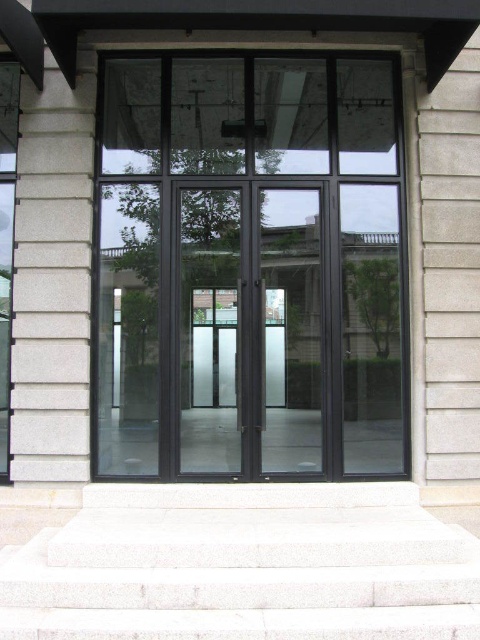
Is black glass window at center above white stone stairs at center?

Yes.

Is black glass window at center bigger than white stone stairs at center?

Yes.

Where is `black glass window at center`? black glass window at center is located at coordinates (251, 268).

Locate an element on the screen. Image resolution: width=480 pixels, height=640 pixels. black glass window at center is located at coordinates (251, 268).